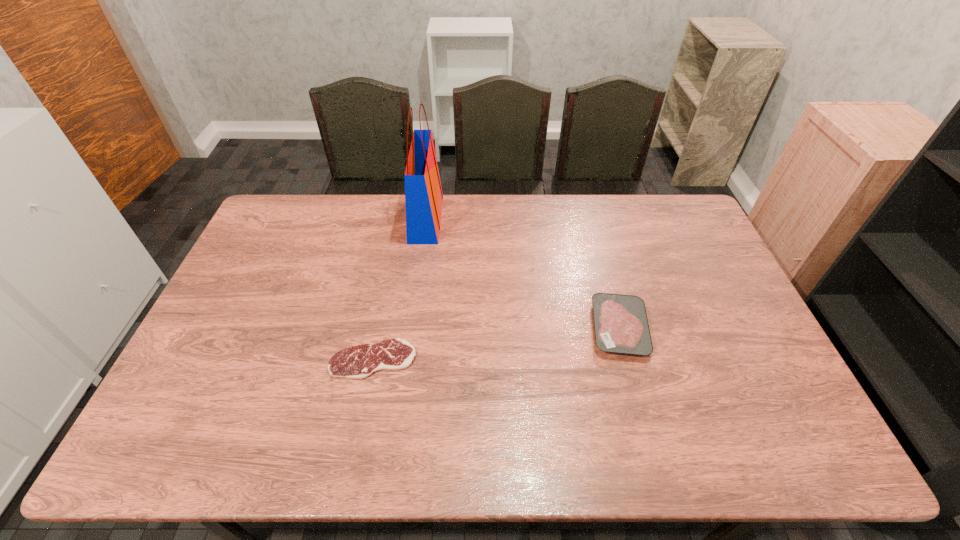
Locate an element on the screen. The width and height of the screenshot is (960, 540). free spot between the left steak and the farthest object is located at coordinates (399, 289).

Where is `unoccupied position between the taller steak and the farthest object`? Image resolution: width=960 pixels, height=540 pixels. unoccupied position between the taller steak and the farthest object is located at coordinates (522, 274).

This screenshot has width=960, height=540. I want to click on empty location between the tallest object and the left steak, so tap(399, 289).

This screenshot has width=960, height=540. Identify the location of empty location between the rightmost object and the shorter steak. (496, 344).

The height and width of the screenshot is (540, 960). In order to click on vacant region between the taller steak and the shortest object in this screenshot , I will do `click(496, 344)`.

At what (x,y) coordinates should I click in order to perform the action: click on object that is the closest to the rightmost object. Please return your answer as a coordinate pair (x, y). The height and width of the screenshot is (540, 960). Looking at the image, I should click on (357, 362).

Find the location of a particular element. This screenshot has height=540, width=960. object that is the closest to the taller steak is located at coordinates (357, 362).

This screenshot has height=540, width=960. What are the coordinates of `free location that satisfies the following two spatial constraints: 1. on the back side of the taller steak; 2. on the handle side of the shopping bag` in the screenshot? It's located at point(589,219).

I want to click on vacant position in the image that satisfies the following two spatial constraints: 1. on the handle side of the rightmost object; 2. on the left side of the farthest object, so click(x=412, y=328).

Identify the location of vacant space that satisfies the following two spatial constraints: 1. on the handle side of the taller steak; 2. on the left side of the shopping bag. (412, 328).